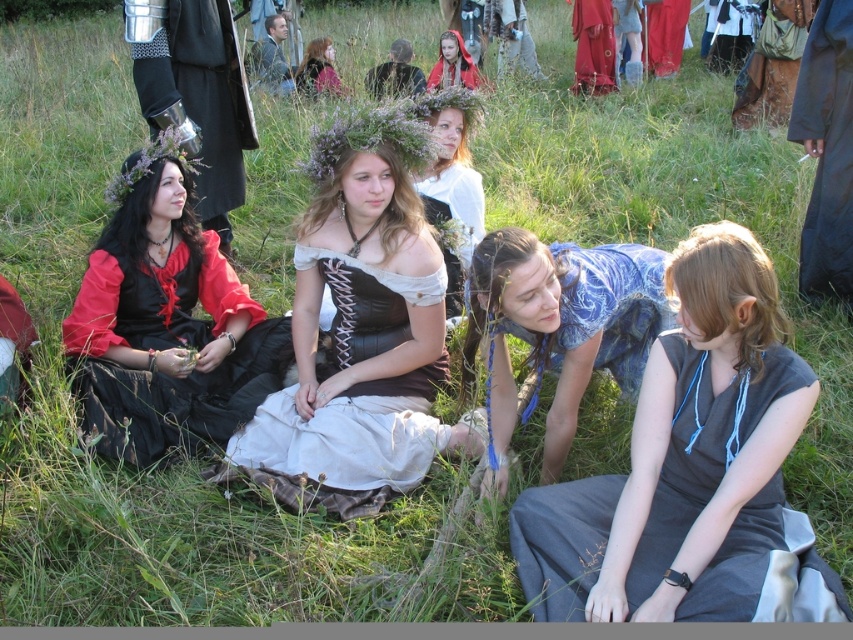
From the picture: You are a costume designer observing the historical reenactment scene. You need to determine which costume is shorter in length between the blue fabric dress at center and the metallic armor at left. Based on the scene, which one is shorter?

The blue fabric dress at center is shorter than the metallic armor at left.

You are a costume designer observing the historical reenactment scene. You need to determine which costume requires more fabric based on their sizes. Which one between the matte red skirt at upper right and the matte brown dress at center needs more fabric?

The matte brown dress at center requires more fabric because it is larger in size than the matte red skirt at upper right.